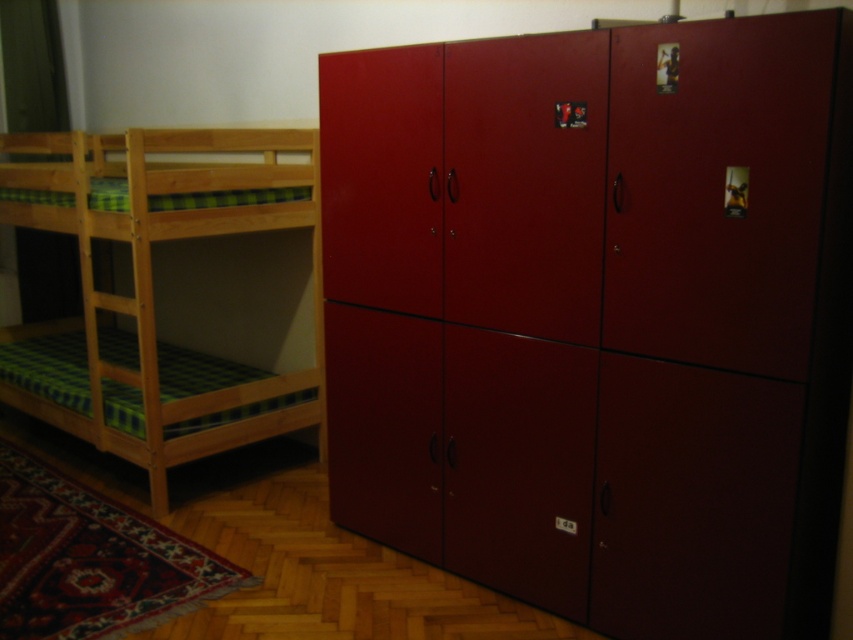
Is glossy wood dresser at right thinner than light brown wooden bunk bed at left?

Indeed, glossy wood dresser at right has a lesser width compared to light brown wooden bunk bed at left.

Which is above, glossy wood dresser at right or light brown wooden bunk bed at left?

light brown wooden bunk bed at left

The width and height of the screenshot is (853, 640). Describe the element at coordinates (596, 316) in the screenshot. I see `glossy wood dresser at right` at that location.

This screenshot has height=640, width=853. I want to click on glossy wood dresser at right, so click(596, 316).